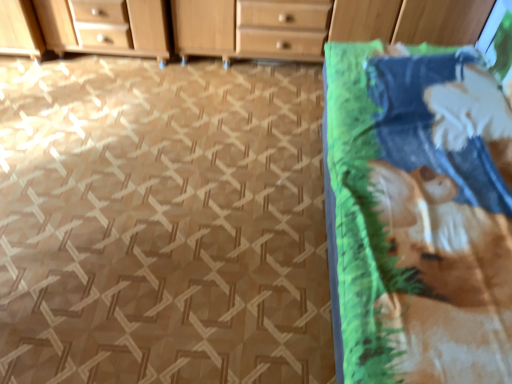
What is the approximate width of wooden chest of drawers at upper center?

wooden chest of drawers at upper center is 17.92 inches wide.

I want to click on wooden chest of drawers at upper center, so click(251, 28).

Between wooden chest of drawers at upper center and printed cotton blanket at right, which one has smaller size?

With smaller size is wooden chest of drawers at upper center.

Between point (223, 47) and point (382, 279), which one is positioned behind?

The point (223, 47) is more distant.

From a real-world perspective, does wooden chest of drawers at upper center sit lower than printed cotton blanket at right?

Indeed, from a real-world perspective, wooden chest of drawers at upper center is positioned beneath printed cotton blanket at right.

Which is nearer, (177, 216) or (185, 25)?

Point (177, 216) appears to be closer to the viewer than point (185, 25).

From the image's perspective, relative to wooden chest of drawers at upper center, is green fabric at right above or below?

Clearly, from the image's perspective, green fabric at right is below wooden chest of drawers at upper center.

Considering the relative sizes of green fabric at right and wooden chest of drawers at upper center in the image provided, is green fabric at right taller than wooden chest of drawers at upper center?

No.

From a real-world perspective, does printed cotton blanket at right stand above green fabric at right?

Yes, from a real-world perspective, printed cotton blanket at right is over green fabric at right

Is printed cotton blanket at right bigger or smaller than green fabric at right?

Clearly, printed cotton blanket at right is larger in size than green fabric at right.

Does point (492, 210) lie behind point (123, 322)?

That is False.

Between green fabric at right and printed cotton blanket at right, which one has less height?

Standing shorter between the two is green fabric at right.

Could you tell me if green fabric at right is facing printed cotton blanket at right?

No, green fabric at right is not oriented towards printed cotton blanket at right.

Between green fabric at right and printed cotton blanket at right, which one is positioned behind?

green fabric at right is more distant.

Considering the positions of points (162, 343) and (471, 307), is point (162, 343) farther from camera compared to point (471, 307)?

Yes.

Considering the sizes of objects printed cotton blanket at right and wooden chest of drawers at upper center in the image provided, who is thinner, printed cotton blanket at right or wooden chest of drawers at upper center?

wooden chest of drawers at upper center is thinner.

Is the surface of printed cotton blanket at right in direct contact with wooden chest of drawers at upper center?

printed cotton blanket at right and wooden chest of drawers at upper center are clearly separated.

Considering the relative sizes of printed cotton blanket at right and wooden chest of drawers at upper center in the image provided, is printed cotton blanket at right smaller than wooden chest of drawers at upper center?

Incorrect, printed cotton blanket at right is not smaller in size than wooden chest of drawers at upper center.

Can you confirm if wooden chest of drawers at upper center is bigger than green fabric at right?

Correct, wooden chest of drawers at upper center is larger in size than green fabric at right.

What's the angular difference between wooden chest of drawers at upper center and green fabric at right's facing directions?

wooden chest of drawers at upper center and green fabric at right are facing 4.59e-05 degrees away from each other.

Is wooden chest of drawers at upper center further to camera compared to green fabric at right?

Yes, wooden chest of drawers at upper center is further from the camera.

From a real-world perspective, is wooden chest of drawers at upper center under green fabric at right?

No, from a real-world perspective, wooden chest of drawers at upper center is not under green fabric at right.

Where is `the chest of drawers lying above the printed cotton blanket at right (from the image's perspective)`? Image resolution: width=512 pixels, height=384 pixels. the chest of drawers lying above the printed cotton blanket at right (from the image's perspective) is located at coordinates (251, 28).

Locate an element on the screen. Image resolution: width=512 pixels, height=384 pixels. tile in front of the wooden chest of drawers at upper center is located at coordinates (162, 223).

Considering their positions, is wooden chest of drawers at upper center positioned closer to green fabric at right than printed cotton blanket at right?

printed cotton blanket at right is positioned closer to the anchor green fabric at right.

Which object lies further to the anchor point wooden chest of drawers at upper center, green fabric at right or printed cotton blanket at right?

printed cotton blanket at right lies further to wooden chest of drawers at upper center than the other object.

Which object lies nearer to the anchor point printed cotton blanket at right, wooden chest of drawers at upper center or green fabric at right?

Among the two, green fabric at right is located nearer to printed cotton blanket at right.

Which object lies nearer to the anchor point wooden chest of drawers at upper center, printed cotton blanket at right or green fabric at right?

The object closer to wooden chest of drawers at upper center is green fabric at right.

Considering their positions, is printed cotton blanket at right positioned closer to green fabric at right than wooden chest of drawers at upper center?

printed cotton blanket at right is positioned closer to the anchor green fabric at right.

From the image, which object appears to be nearer to printed cotton blanket at right, green fabric at right or wooden chest of drawers at upper center?

Among the two, green fabric at right is located nearer to printed cotton blanket at right.

The width and height of the screenshot is (512, 384). Find the location of `tile located between printed cotton blanket at right and wooden chest of drawers at upper center in the depth direction`. tile located between printed cotton blanket at right and wooden chest of drawers at upper center in the depth direction is located at coordinates (162, 223).